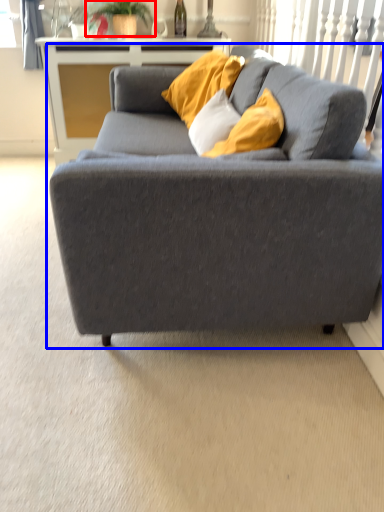
Question: Which object is further to the camera taking this photo, plant (highlighted by a red box) or studio couch (highlighted by a blue box)?

Choices:
 (A) plant
 (B) studio couch

Answer: (A)